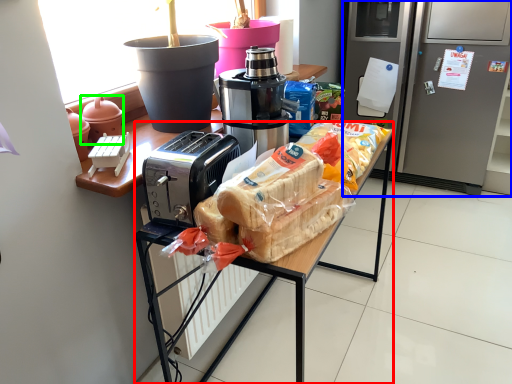
Question: Which object is positioned closest to desk (highlighted by a red box)? Select from home appliance (highlighted by a blue box) and appliance (highlighted by a green box).

Choices:
 (A) home appliance
 (B) appliance

Answer: (B)